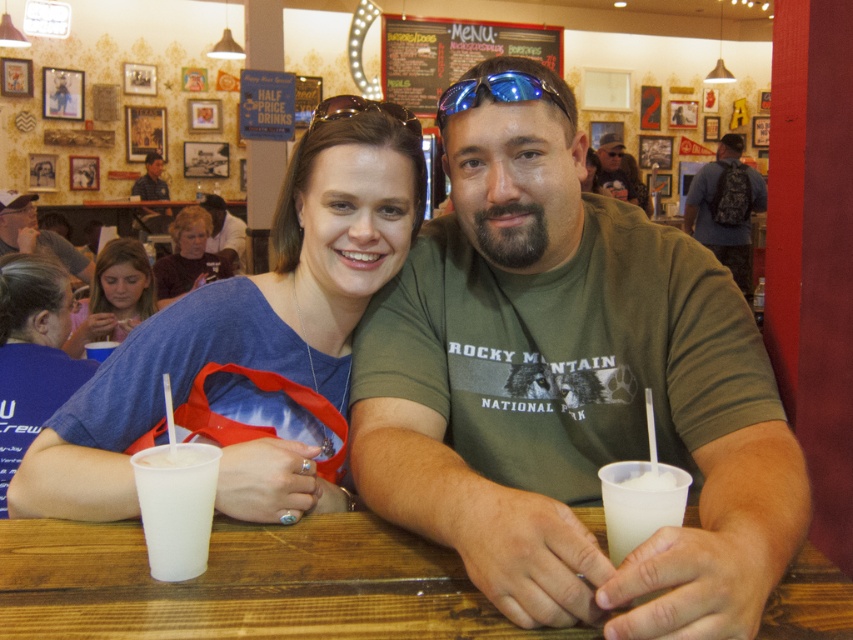
You are standing at the point marked as point (735, 381) in a diner. You want to place a 12 inch long tray on the floor. Is there enough space between you and the nearest wall to safely place the tray without it hitting anything?

The distance between point (735, 381) and the nearest wall is 38.17 inches, which is more than enough space to safely place a 12 inch long tray without it hitting anything.

You are a customer at this diner and want to order a drink. The server, wearing the blue uniform shirt at upper left, brings you a white frothy drink at lower center. Considering the size of the drink, would you ask for a larger portion?

The white frothy drink at lower center has a smaller size compared to the blue uniform shirt at upper left, so it might be appropriate to ask for a larger portion if you prefer a bigger drink.

You are a customer in this diner and want to reach for the white frothy drink at lower center. Based on its position, can you estimate where it is located relative to your current position?

The white frothy drink at lower center is located at coordinates point (639, 502), which is towards the lower right side of the image from your perspective. So you should reach towards the lower right direction to get it.